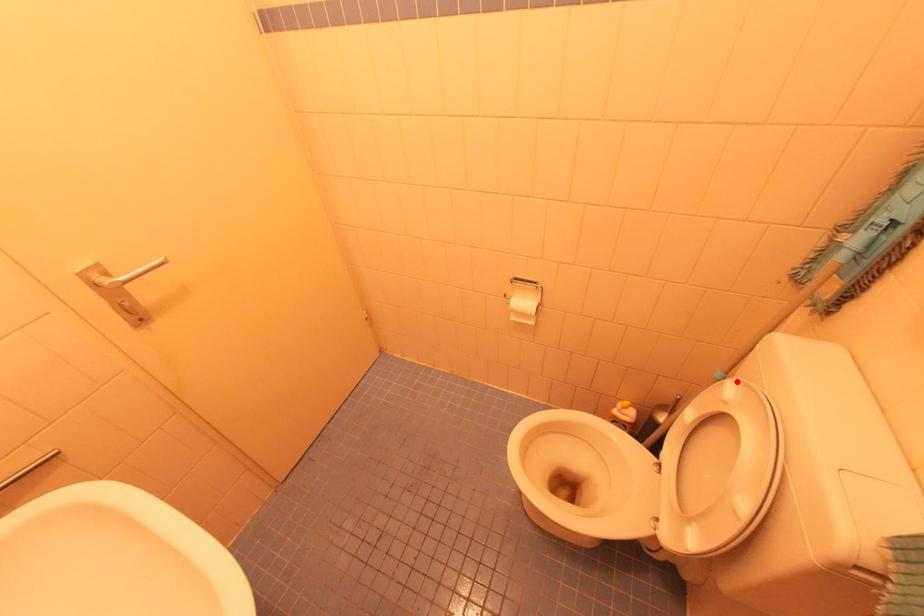
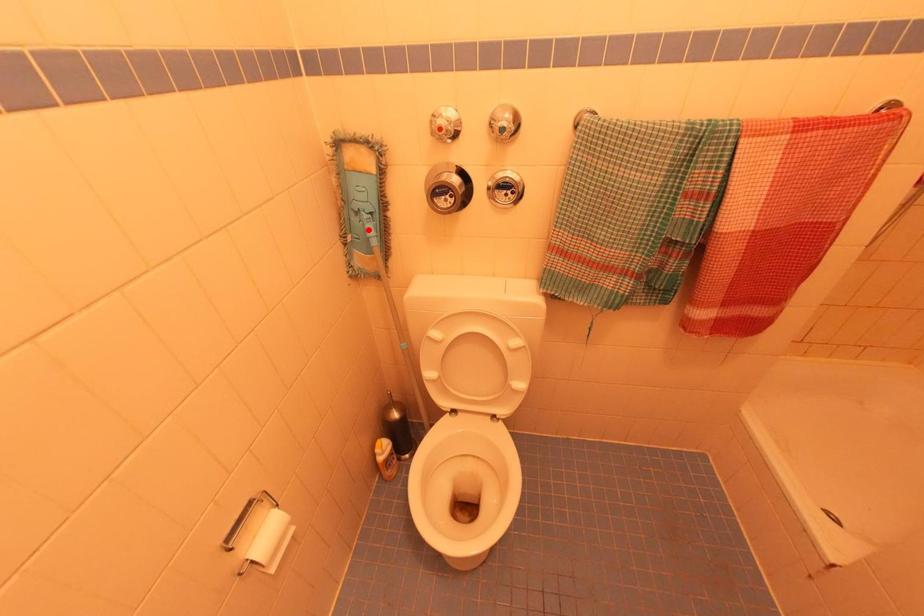
I am providing you with two images of the same scene from different viewpoints. A red point is marked on the first image and another point is marked on the second image. Is the red point in image1 aligned with the point shown in image2?

No